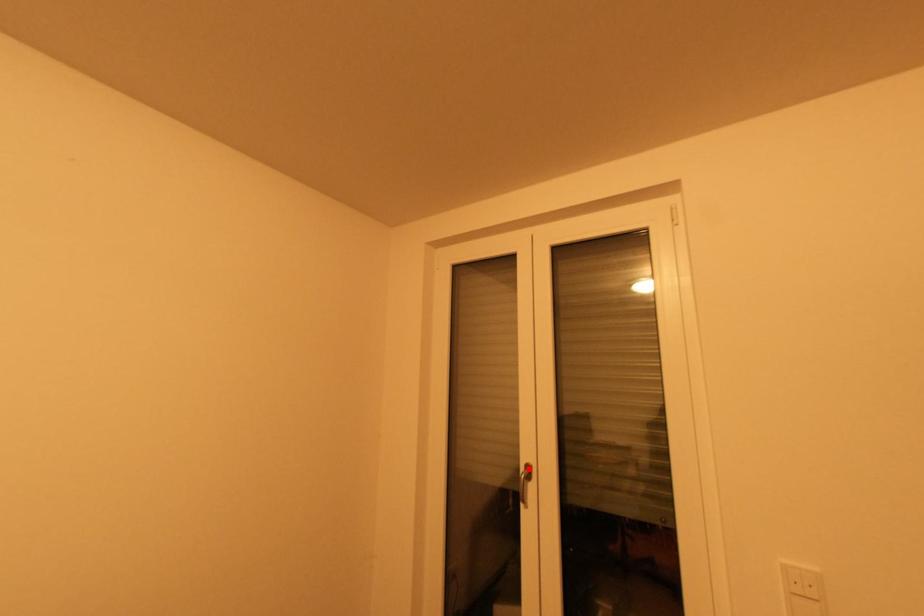
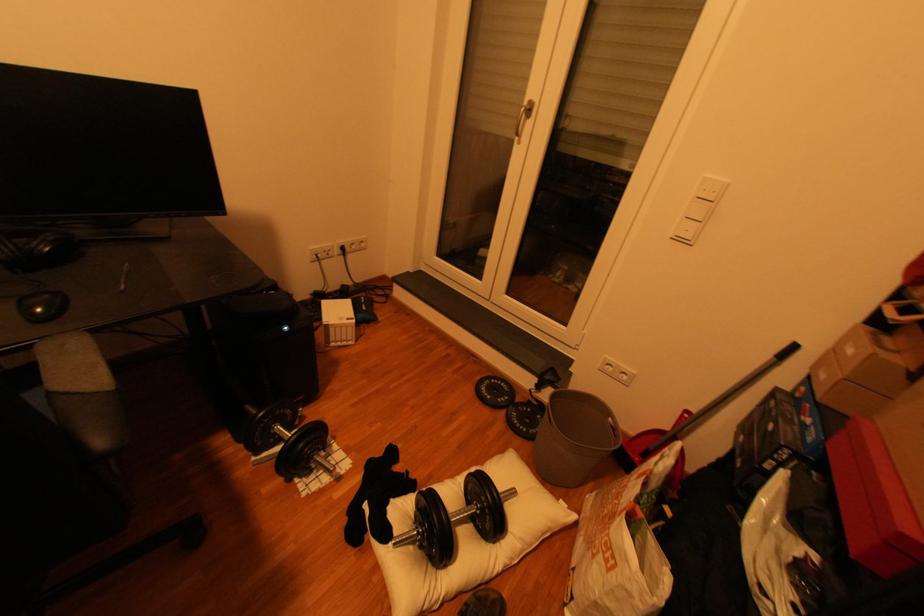
The point at the highlighted location is marked in the first image. Where is the corresponding point in the second image?

(533, 100)